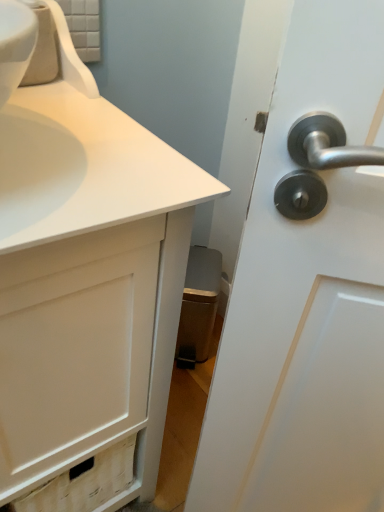
Question: Is white matte cabinet at lower left surrounding white glossy faucet at upper left?

Choices:
 (A) yes
 (B) no

Answer: (A)

Question: Can you confirm if white matte cabinet at lower left is bigger than white glossy faucet at upper left?

Choices:
 (A) no
 (B) yes

Answer: (B)

Question: Can you confirm if white matte cabinet at lower left is wider than white glossy faucet at upper left?

Choices:
 (A) no
 (B) yes

Answer: (B)

Question: Is white matte cabinet at lower left oriented towards white glossy faucet at upper left?

Choices:
 (A) no
 (B) yes

Answer: (A)

Question: Does white matte cabinet at lower left lie in front of white glossy faucet at upper left?

Choices:
 (A) yes
 (B) no

Answer: (A)

Question: From a real-world perspective, is white matte cabinet at lower left under white glossy faucet at upper left?

Choices:
 (A) no
 (B) yes

Answer: (B)

Question: Is white glossy faucet at upper left at the left side of white matte cabinet at lower left?

Choices:
 (A) yes
 (B) no

Answer: (A)

Question: From the image's perspective, is white glossy faucet at upper left below white matte cabinet at lower left?

Choices:
 (A) no
 (B) yes

Answer: (A)

Question: From the image's perspective, is white glossy faucet at upper left above white matte cabinet at lower left?

Choices:
 (A) no
 (B) yes

Answer: (B)

Question: Is white glossy faucet at upper left smaller than white matte cabinet at lower left?

Choices:
 (A) no
 (B) yes

Answer: (B)

Question: Is white glossy faucet at upper left wider than white matte cabinet at lower left?

Choices:
 (A) no
 (B) yes

Answer: (A)

Question: Does white glossy faucet at upper left lie behind white matte cabinet at lower left?

Choices:
 (A) no
 (B) yes

Answer: (B)

Question: Looking at their shapes, would you say white glossy faucet at upper left is wider or thinner than white matte cabinet at lower left?

Choices:
 (A) thin
 (B) wide

Answer: (A)